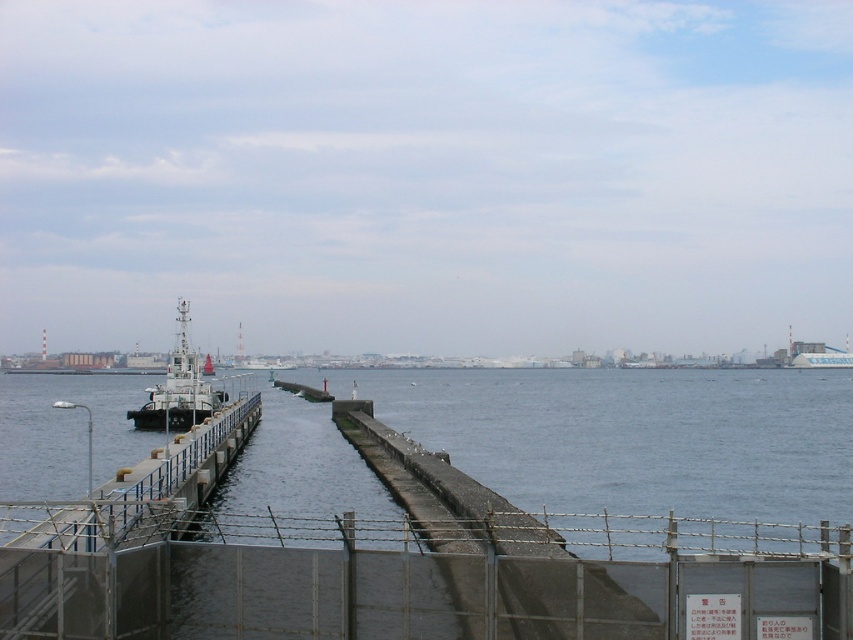
Can you confirm if metallic chain-link fence at center is smaller than metallic gray ship at center-left?

Yes.

Can you confirm if metallic chain-link fence at center is positioned above metallic gray ship at center-left?

Yes, metallic chain-link fence at center is above metallic gray ship at center-left.

Which is behind, point (467, 532) or point (202, 410)?

Point (202, 410)

This screenshot has height=640, width=853. Find the location of `metallic chain-link fence at center`. metallic chain-link fence at center is located at coordinates (409, 580).